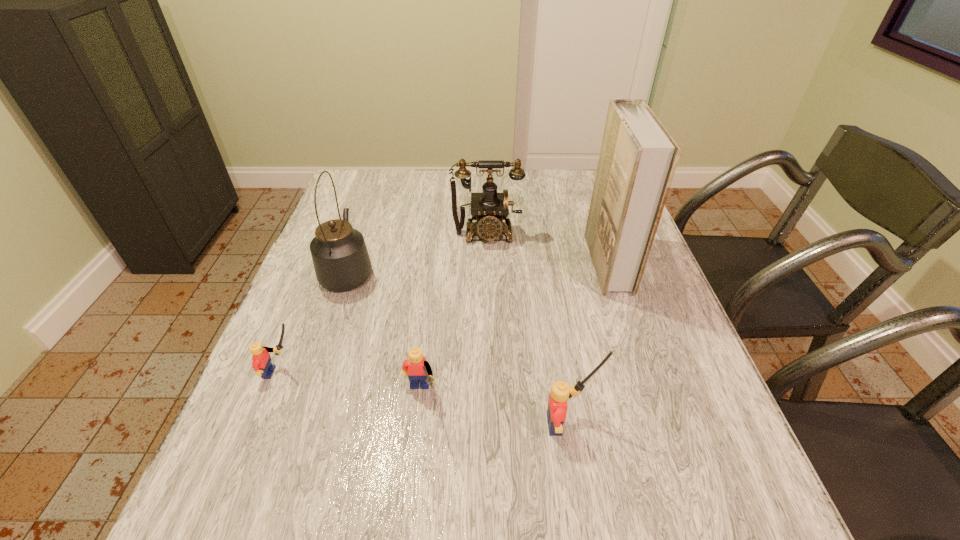
In order to click on vacant spot to place a Lego on the right in this screenshot , I will do `click(742, 455)`.